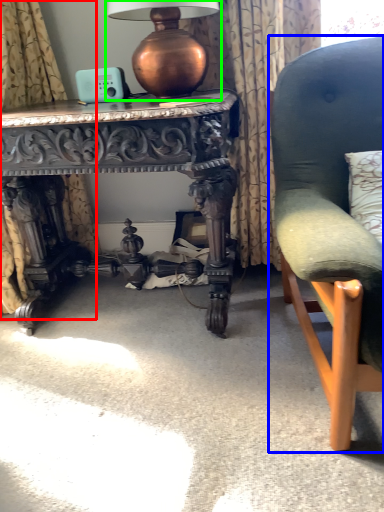
Question: Considering the real-world distances, which object is farthest from curtain (highlighted by a red box)? chair (highlighted by a blue box) or table lamp (highlighted by a green box)?

Choices:
 (A) chair
 (B) table lamp

Answer: (A)